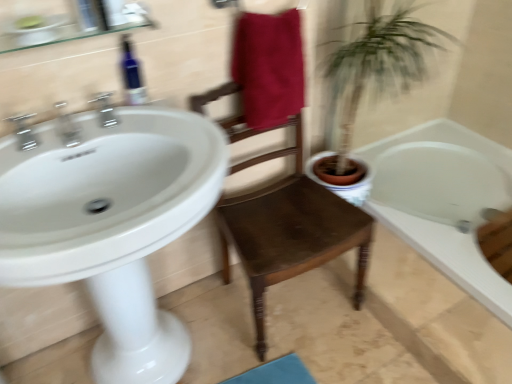
Image resolution: width=512 pixels, height=384 pixels. In order to click on vacant point to the right of chrome metallic faucet at upper left, positioned as the first tap in left-to-right order in this screenshot , I will do `click(80, 139)`.